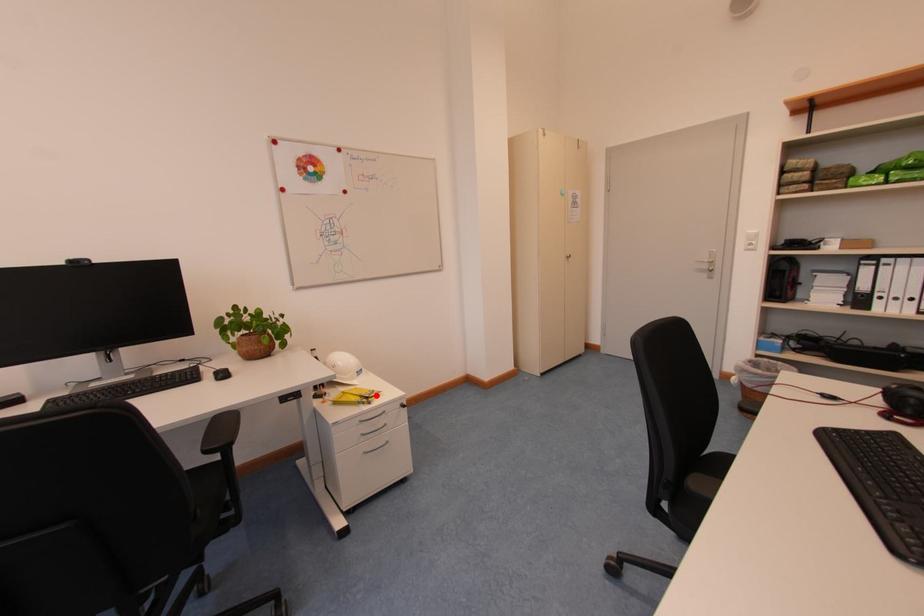
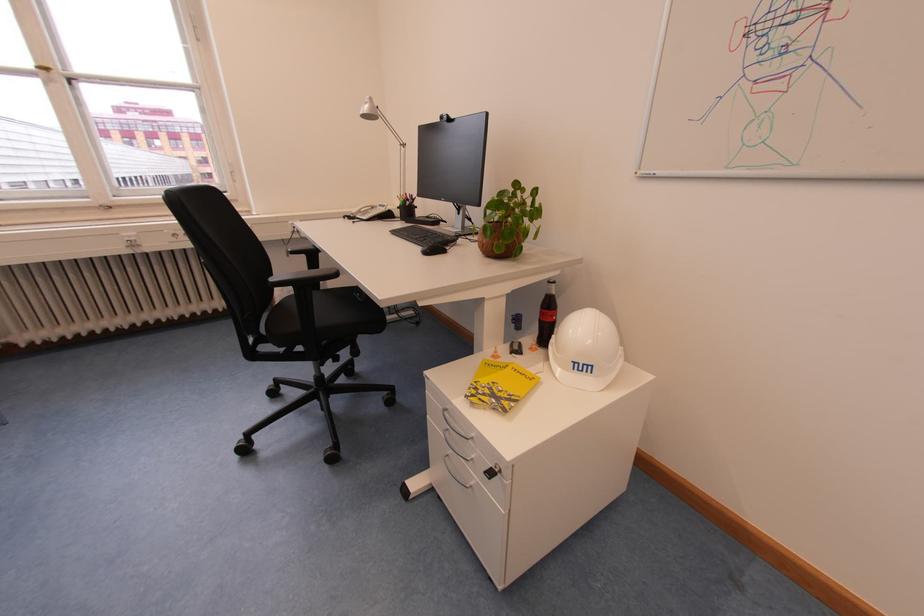
Locate, in the second image, the point that corresponds to the highlighted location in the first image.

(507, 397)